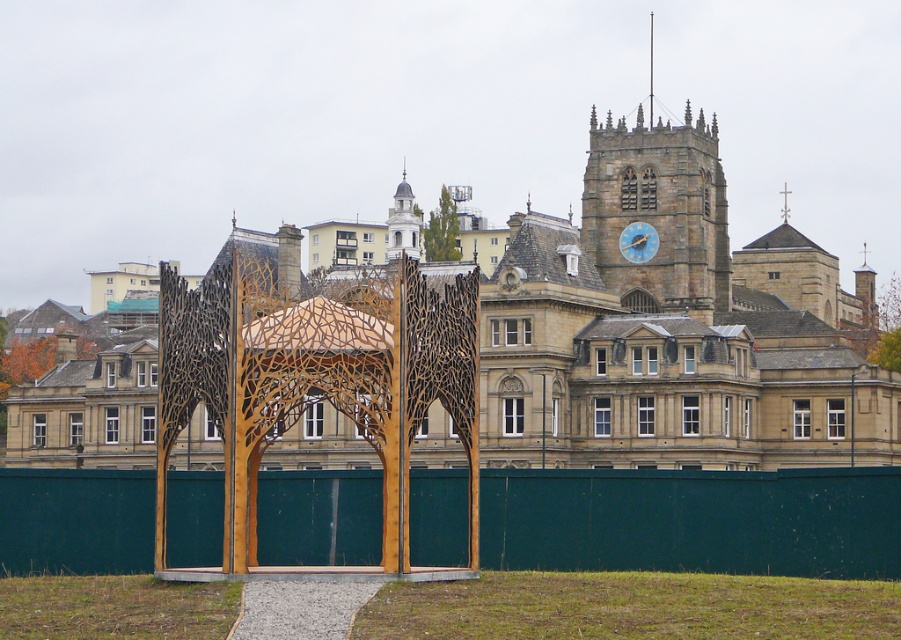
Question: Does smooth white tower at center have a larger size compared to green leafy tree at upper center?

Choices:
 (A) no
 (B) yes

Answer: (B)

Question: Which object is positioned closest to the smooth white tower at center?

Choices:
 (A) orange leafy tree at left
 (B) stone clock tower at upper right
 (C) wooden lattice gazebo at center
 (D) green leafy tree at upper center

Answer: (D)

Question: Can you confirm if green wooden fence at center is positioned above stone clock tower at upper right?

Choices:
 (A) no
 (B) yes

Answer: (A)

Question: Can you confirm if wooden lattice gazebo at center is wider than orange leafy tree at left?

Choices:
 (A) yes
 (B) no

Answer: (B)

Question: Estimate the real-world distances between objects in this image. Which object is closer to the orange leafy tree at left?

Choices:
 (A) green wooden fence at center
 (B) green leafy tree at upper center

Answer: (B)

Question: Which object is farther from the camera taking this photo?

Choices:
 (A) smooth white tower at center
 (B) green wooden fence at center

Answer: (A)